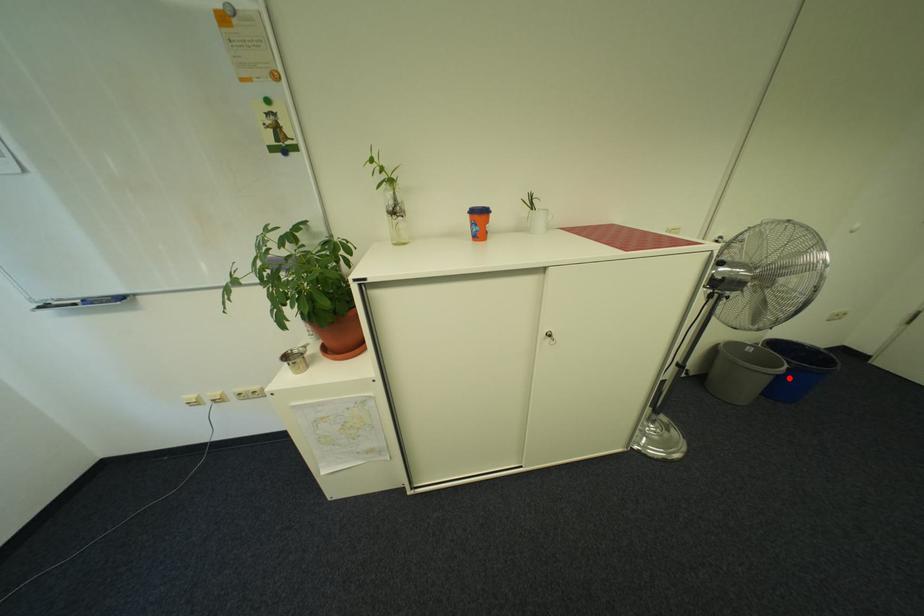
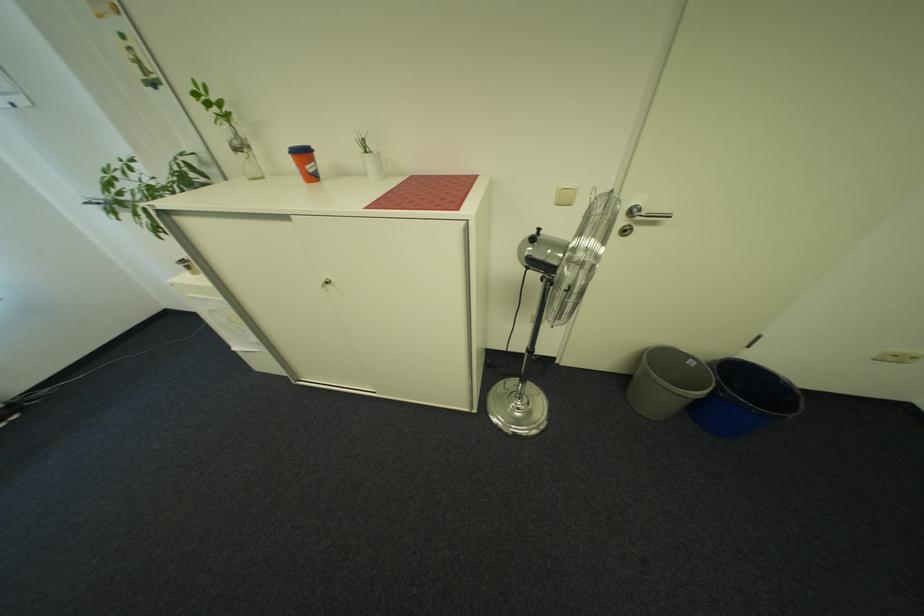
Question: I am providing you with two images of the same scene from different viewpoints. A red point is shown in image1. For the corresponding object point in image2, is it positioned nearer or farther from the camera?

Choices:
 (A) Nearer
 (B) Farther

Answer: (A)